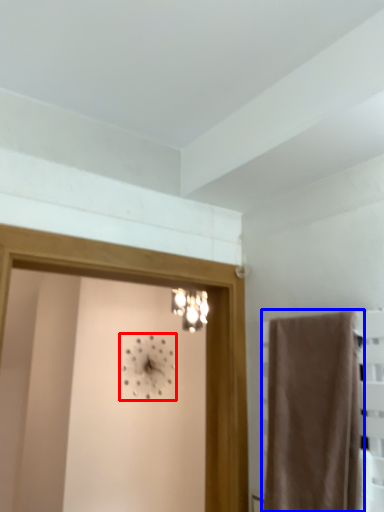
Question: Among these objects, which one is farthest to the camera, clock (highlighted by a red box) or curtain (highlighted by a blue box)?

Choices:
 (A) clock
 (B) curtain

Answer: (A)